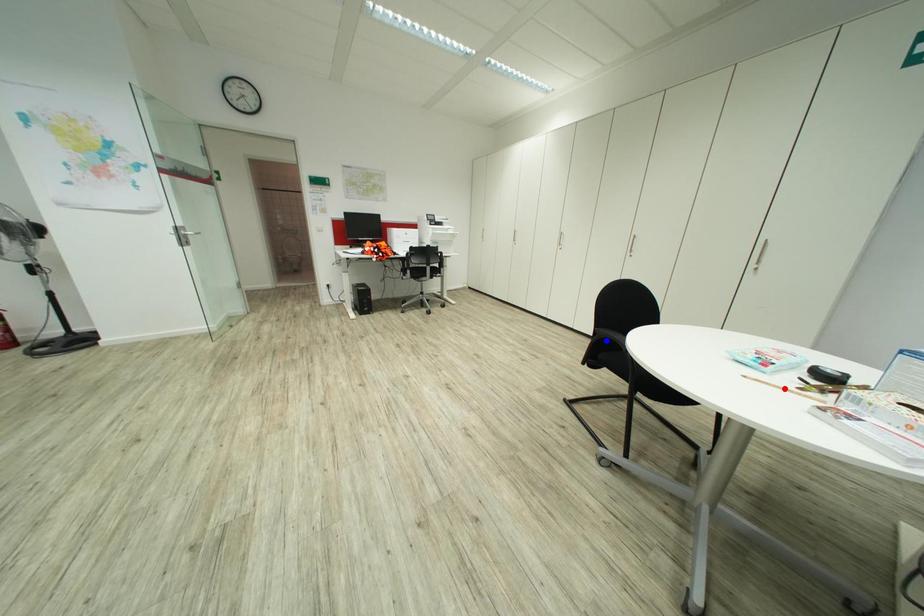
Question: Which of the two points in the image is closer to the camera?

Choices:
 (A) Blue point is closer.
 (B) Red point is closer.

Answer: (B)